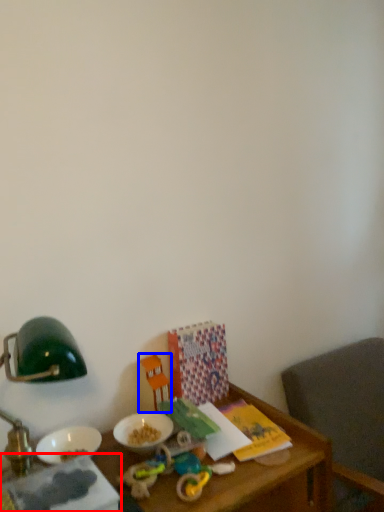
Question: Which point is further to the camera, book (highlighted by a red box) or toy (highlighted by a blue box)?

Choices:
 (A) book
 (B) toy

Answer: (B)